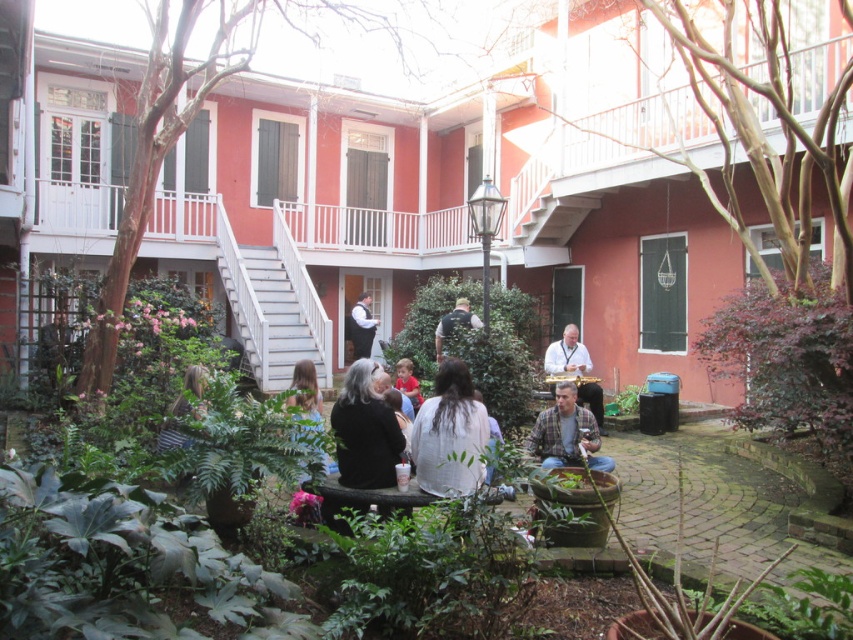
Question: Which of the following is the farthest from the observer?

Choices:
 (A) (419, 396)
 (B) (368, 301)
 (C) (567, 422)

Answer: (B)

Question: Where is white matte shirt at center located in relation to light brown hair at lower center in the image?

Choices:
 (A) right
 (B) left

Answer: (A)

Question: Does black matte jacket at center have a smaller size compared to plaid shirt at center?

Choices:
 (A) no
 (B) yes

Answer: (B)

Question: Is light brown hair at lower center positioned behind red shirt at center?

Choices:
 (A) yes
 (B) no

Answer: (B)

Question: Which point appears closest to the camera in this image?

Choices:
 (A) (318, 404)
 (B) (634, 385)
 (C) (160, 451)

Answer: (C)

Question: Among these objects, which one is nearest to the camera?

Choices:
 (A) white matte shirt at center
 (B) light brown hair at lower center
 (C) black matte jacket at center

Answer: (A)